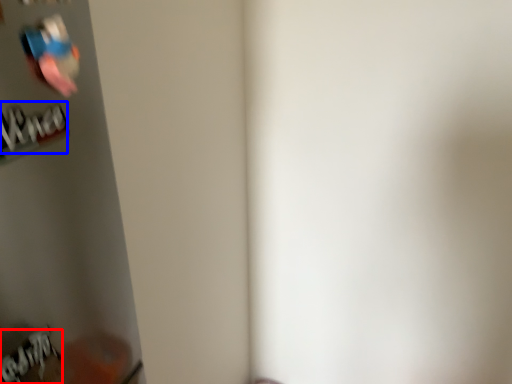
Question: Which of the following is the farthest to the observer, writing (highlighted by a red box) or writing (highlighted by a blue box)?

Choices:
 (A) writing
 (B) writing

Answer: (A)